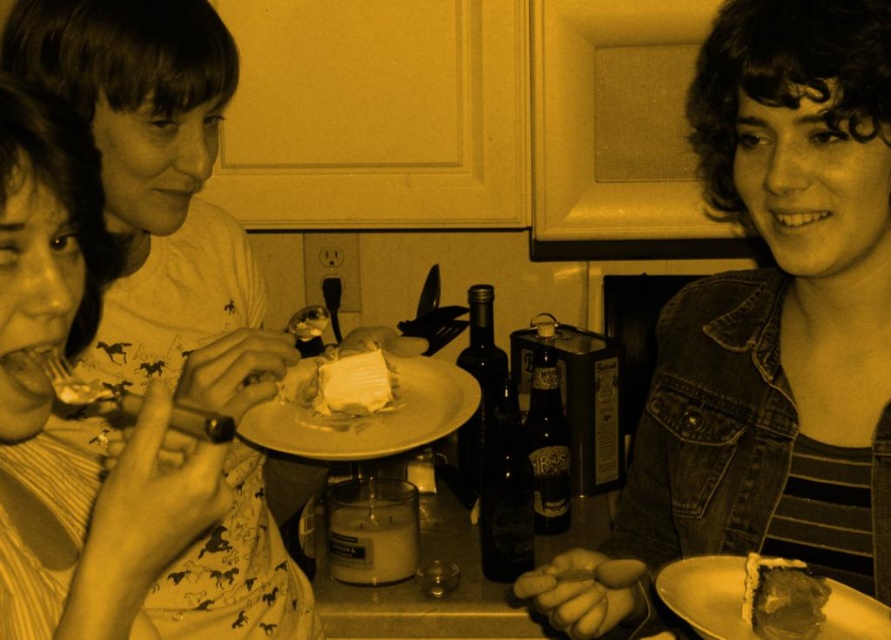
You are sitting at the table and want to reach for the closest plate to you. Which one should you choose between the white matte plate at center and the matte white plate at lower right?

The white matte plate at center is closer to you than the matte white plate at lower right, so you should choose the white matte plate at center.